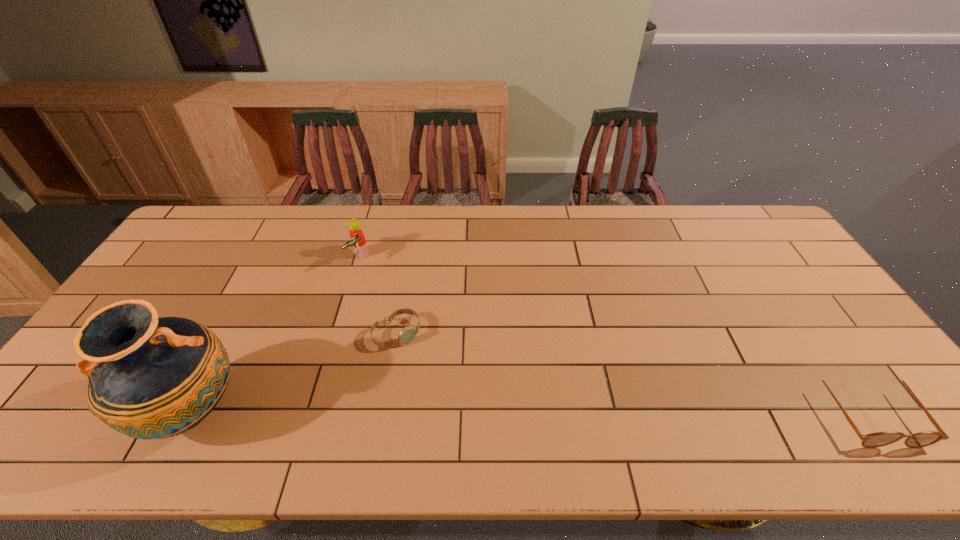
At what (x,y) coordinates should I click in order to perform the action: click on free spot on the desktop that is between the pottery and the sunglasses and is positioned in front of the second object from left to right with the accessory visible. Please return your answer as a coordinate pair (x, y). The height and width of the screenshot is (540, 960). Looking at the image, I should click on (542, 410).

Find the location of a particular element. This screenshot has width=960, height=540. free space on the desktop that is between the tallest object and the sunglasses and is positioned on the face of the second object from right to left is located at coordinates (466, 410).